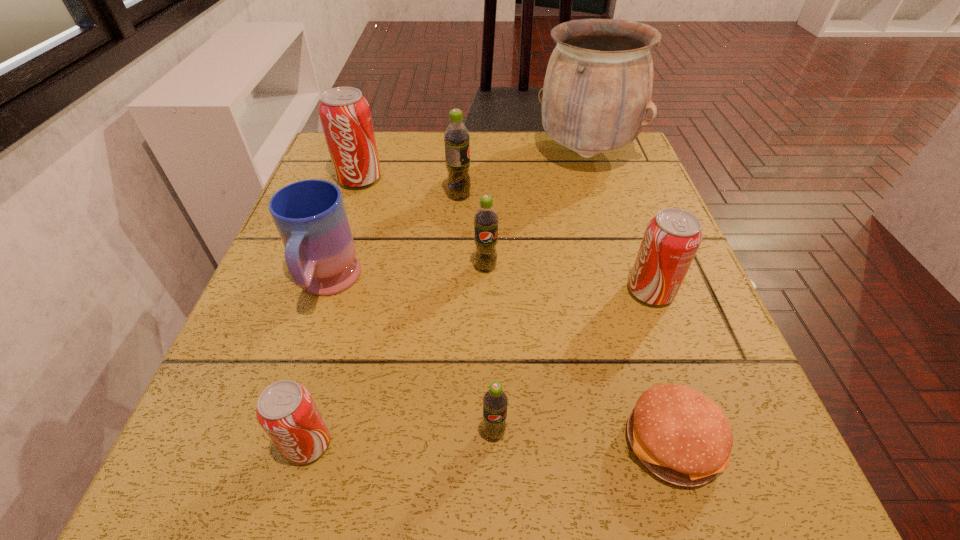
Where is `the tallest object`? the tallest object is located at coordinates (598, 85).

Locate an element on the screen. The width and height of the screenshot is (960, 540). the farthest red soda can is located at coordinates (345, 115).

Image resolution: width=960 pixels, height=540 pixels. What are the coordinates of `the farthest green soda` in the screenshot? It's located at (456, 137).

In order to click on the third soda can from left to right in this screenshot , I will do `click(456, 137)`.

The image size is (960, 540). Identify the location of mug. (310, 216).

I want to click on the second nearest red soda can, so [671, 239].

Image resolution: width=960 pixels, height=540 pixels. What are the coordinates of `the rightmost red soda can` in the screenshot? It's located at (671, 239).

Image resolution: width=960 pixels, height=540 pixels. I want to click on the second biggest green soda, so click(486, 219).

At what (x,y) coordinates should I click in order to perform the action: click on the smallest green soda. Please return your answer as a coordinate pair (x, y). Looking at the image, I should click on (495, 401).

Locate an element on the screen. The height and width of the screenshot is (540, 960). the nearest red soda can is located at coordinates (286, 411).